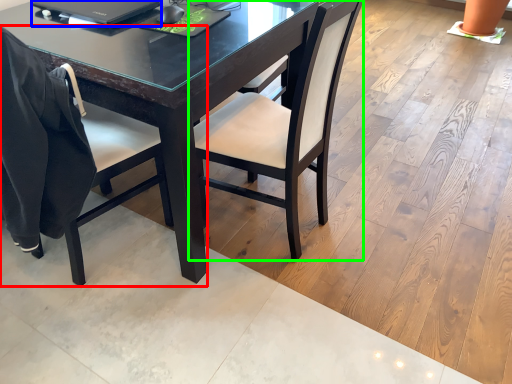
Question: Estimate the real-world distances between objects in this image. Which object is closer to chair (highlighted by a red box), laptop (highlighted by a blue box) or chair (highlighted by a green box)?

Choices:
 (A) laptop
 (B) chair

Answer: (B)